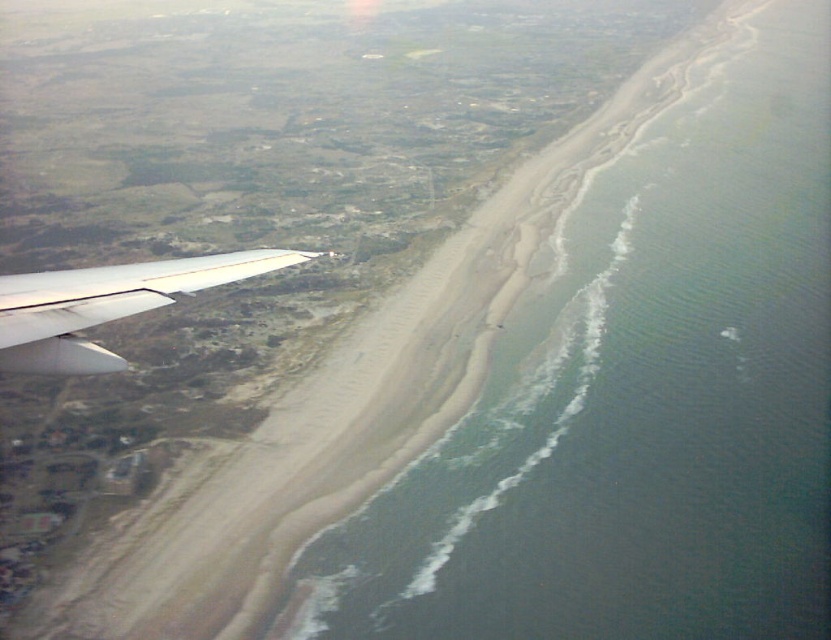
You are a pilot looking at the coastal landscape through the airplane window. You see two points marked on the image. Which point is closer to the airplane window, point (607, 244) or point (18, 332)?

Point (607, 244) is further to the viewer than point (18, 332). Therefore, point (18, 332) is closer to the airplane window.

You are a pilot flying at an altitude of 400 meters. You notice the white matte wing at lower left and the green water at beach right from your window. How far apart are these two landmarks from each other?

The green water at beach right is 372.98 meters away from the white matte wing at lower left.

You are a passenger on the airplane and looking out the window. You see the white matte wing at lower left and the green water at beach right. Which object is closer to the airplane?

The white matte wing at lower left is closer to the airplane because it is positioned below the green water at beach right, which is further away.